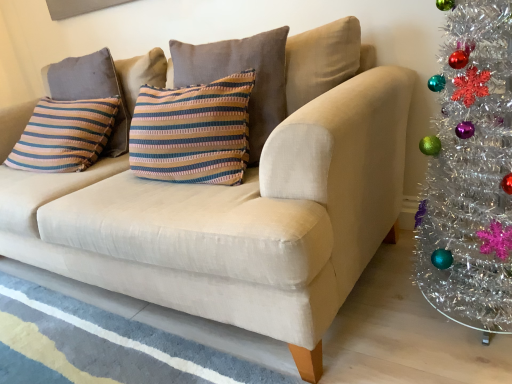
Question: Relative to striped fabric pillow at center, the first pillow from the front, is striped fabric pillow at upper left, the 1th pillow viewed from the back, in front or behind?

Choices:
 (A) behind
 (B) front

Answer: (A)

Question: From a real-world perspective, is striped fabric pillow at upper left, the 2th pillow positioned from the right, physically located above or below striped fabric pillow at center, the 2th pillow viewed from the back?

Choices:
 (A) above
 (B) below

Answer: (B)

Question: Considering the positions of striped fabric pillow at upper left, the 1th pillow viewed from the back, and striped fabric pillow at center, the first pillow from the front, in the image, is striped fabric pillow at upper left, the 1th pillow viewed from the back, wider or thinner than striped fabric pillow at center, the first pillow from the front,?

Choices:
 (A) thin
 (B) wide

Answer: (A)

Question: Looking at the image, does striped fabric pillow at center, the 2th pillow in the left-to-right sequence, seem bigger or smaller compared to striped fabric pillow at upper left, the 1th pillow viewed from the back?

Choices:
 (A) small
 (B) big

Answer: (B)

Question: Is striped fabric pillow at center, the 2th pillow in the left-to-right sequence, in front of or behind striped fabric pillow at upper left, the second pillow positioned from the front, in the image?

Choices:
 (A) behind
 (B) front

Answer: (B)

Question: Based on their positions, is striped fabric pillow at center, which appears as the first pillow when viewed from the right, located to the left or right of striped fabric pillow at upper left, the second pillow positioned from the front?

Choices:
 (A) left
 (B) right

Answer: (B)

Question: From the image's perspective, relative to striped fabric pillow at upper left, marked as the 1th pillow in a left-to-right arrangement, is striped fabric pillow at center, the 2th pillow in the left-to-right sequence, above or below?

Choices:
 (A) above
 (B) below

Answer: (B)